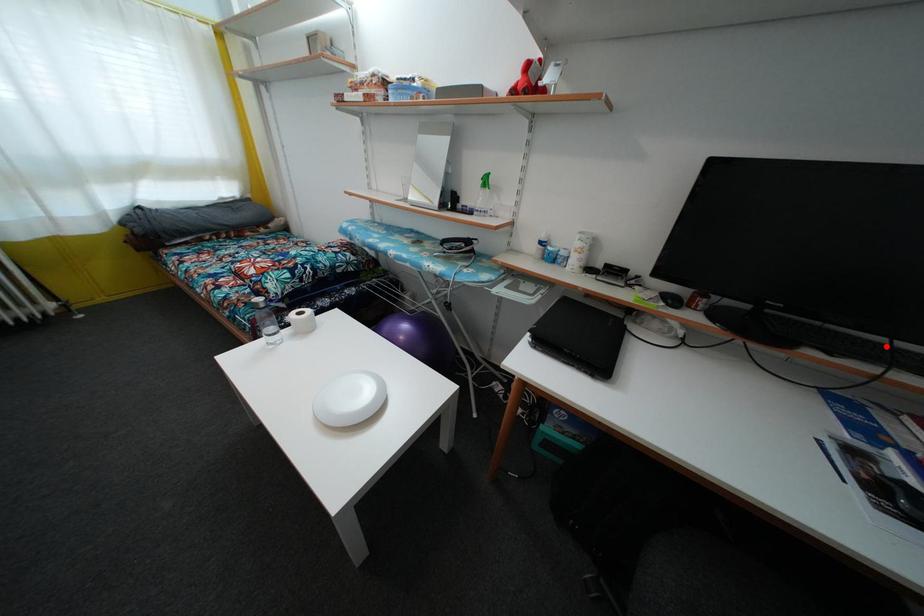
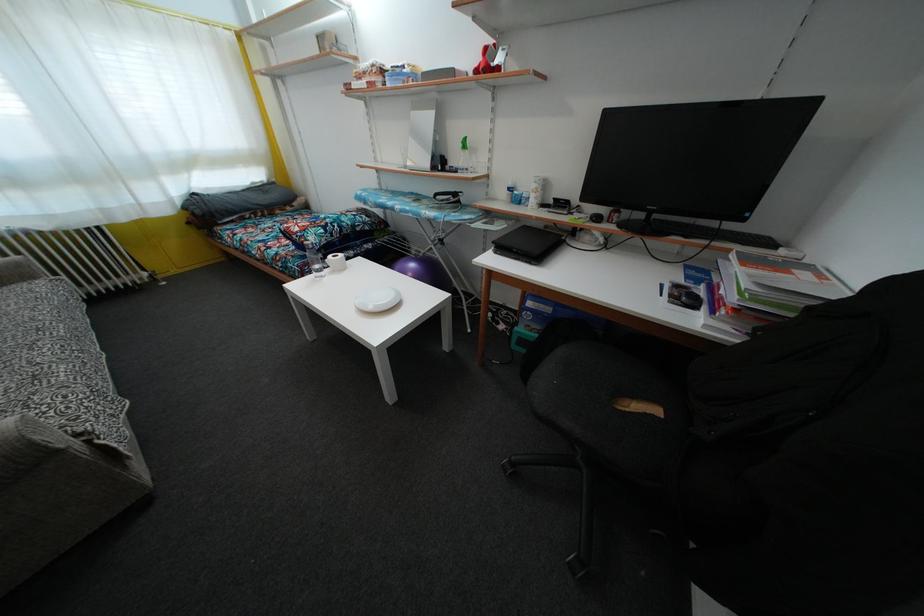
Locate, in the second image, the point that corresponds to the highlighted location in the first image.

(719, 230)